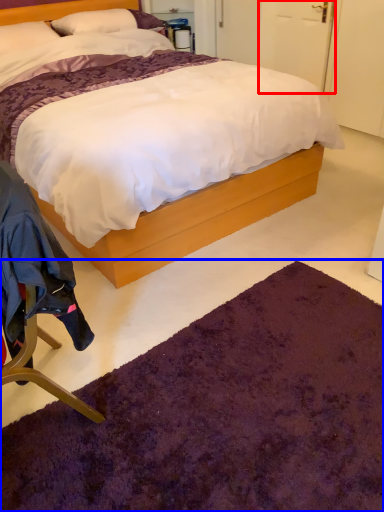
Question: Which of the following is the closest to the observer, door (highlighted by a red box) or mat (highlighted by a blue box)?

Choices:
 (A) door
 (B) mat

Answer: (B)